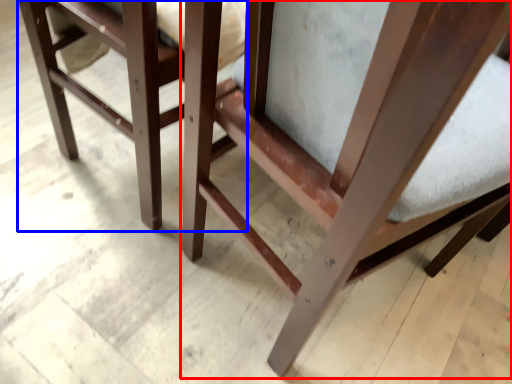
Question: Which of the following is the closest to the observer, chair (highlighted by a red box) or furniture (highlighted by a blue box)?

Choices:
 (A) chair
 (B) furniture

Answer: (A)